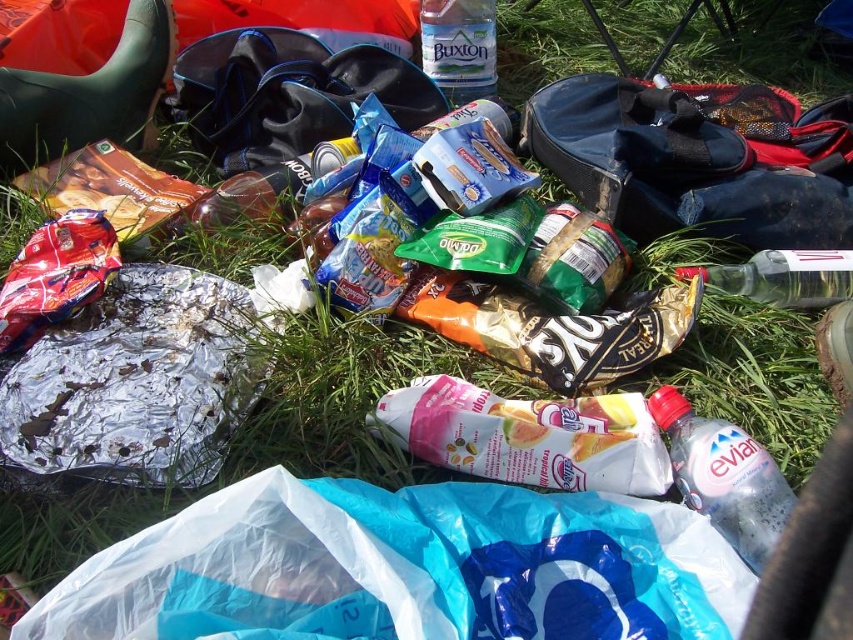
You are organizing the items on the grass. You need to place the white matte snack packet at center and the clear plastic bottle at lower right into separate containers. Which item is on top of the other?

The white matte snack packet at center is positioned over the clear plastic bottle at lower right, so it is on top.